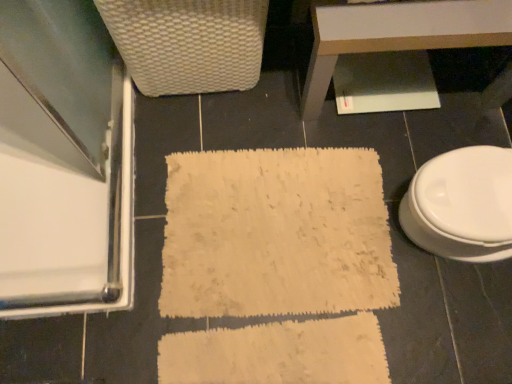
Question: Considering the positions of white woven basket at upper left and white glossy table at upper center in the image, is white woven basket at upper left taller or shorter than white glossy table at upper center?

Choices:
 (A) short
 (B) tall

Answer: (B)

Question: Do you think white woven basket at upper left is within white glossy table at upper center, or outside of it?

Choices:
 (A) inside
 (B) outside

Answer: (B)

Question: Which is nearer to the white glossy table at upper center?

Choices:
 (A) white glossy toilet at right
 (B) clear glass screen door at left
 (C) white woven basket at upper left
 (D) white textured bath mat at center

Answer: (C)

Question: Which is farther from the white glossy table at upper center?

Choices:
 (A) white textured bath mat at center
 (B) white glossy toilet at right
 (C) white woven basket at upper left
 (D) clear glass screen door at left

Answer: (D)